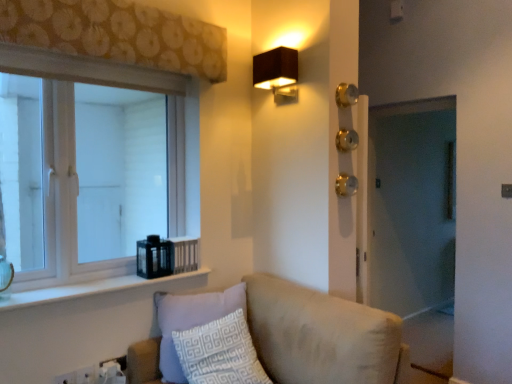
This screenshot has width=512, height=384. What do you see at coordinates (322, 336) in the screenshot?
I see `beige fabric couch at lower center` at bounding box center [322, 336].

This screenshot has height=384, width=512. Find the location of `clear glass vase at left`. clear glass vase at left is located at coordinates (5, 277).

Image resolution: width=512 pixels, height=384 pixels. I want to click on gold metallic door handle at center-right, so click(x=346, y=185).

Can you confirm if white wood window at left is wider than gold metallic door handle at center-right?

Indeed, white wood window at left has a greater width compared to gold metallic door handle at center-right.

Could you tell me if white wood window at left is turned towards gold metallic door handle at center-right?

No, white wood window at left is not facing towards gold metallic door handle at center-right.

Would you say white wood window at left is inside or outside gold metallic door handle at center-right?

white wood window at left is located beyond the bounds of gold metallic door handle at center-right.

Consider the image. What's the angular difference between white plastic electric outlet at lower left, positioned as the second electric outlet in right-to-left order, and beige fabric couch at lower center's facing directions?

The angular difference between white plastic electric outlet at lower left, positioned as the second electric outlet in right-to-left order, and beige fabric couch at lower center is 90.2 degrees.

Find the location of a particular element. This screenshot has height=384, width=512. studio couch above the white plastic electric outlet at lower left, the first electric outlet from the left (from the image's perspective) is located at coordinates (322, 336).

From a real-world perspective, which is physically above, white plastic electric outlet at lower left, which ranks as the first electric outlet in front-to-back order, or beige fabric couch at lower center?

beige fabric couch at lower center, from a real-world perspective.

Choose the correct answer: Is white plastic electric outlet at lower left, positioned as the 2th electric outlet in back-to-front order, inside beige fabric couch at lower center or outside it?

white plastic electric outlet at lower left, positioned as the 2th electric outlet in back-to-front order, exists outside the volume of beige fabric couch at lower center.

Considering the sizes of white wood window at left and beige fabric couch at lower center in the image, is white wood window at left wider or thinner than beige fabric couch at lower center?

Clearly, white wood window at left has less width compared to beige fabric couch at lower center.

From the picture: Considering the positions of objects white wood window at left and beige fabric couch at lower center in the image provided, who is in front, white wood window at left or beige fabric couch at lower center?

beige fabric couch at lower center is more forward.

Considering the sizes of objects white wood window at left and beige fabric couch at lower center in the image provided, who is taller, white wood window at left or beige fabric couch at lower center?

white wood window at left is taller.

Is white wood window at left facing towards beige fabric couch at lower center?

No, white wood window at left is not facing towards beige fabric couch at lower center.

Does point (80, 381) appear closer or farther from the camera than point (165, 53)?

Point (80, 381) appears to be closer to the viewer than point (165, 53).

Identify the location of curtain on the right side of white plastic electric outlet at lower left, marked as the 2th electric outlet in a left-to-right arrangement. (118, 34).

From the image's perspective, is white plastic electric outlet at lower left, which is counted as the first electric outlet, starting from the right, below brown floral fabric at upper left?

Yes, from the image's perspective, white plastic electric outlet at lower left, which is counted as the first electric outlet, starting from the right, is below brown floral fabric at upper left.

Is white plastic electric outlet at lower left, which is the second electric outlet in front-to-back order, in contact with brown floral fabric at upper left?

They are not placed beside each other.

Considering the sizes of objects clear glass vase at left and white glossy window sill at lower left in the image provided, who is smaller, clear glass vase at left or white glossy window sill at lower left?

Smaller between the two is clear glass vase at left.

Can you confirm if clear glass vase at left is wider than white glossy window sill at lower left?

No, clear glass vase at left is not wider than white glossy window sill at lower left.

In the scene shown: From a real-world perspective, relative to white glossy window sill at lower left, is clear glass vase at left vertically above or below?

clear glass vase at left is situated higher than white glossy window sill at lower left in the real world.

In the scene shown: From the image's perspective, between gold metallic door handle at center-right and brown floral fabric at upper left, who is located below?

gold metallic door handle at center-right, from the image's perspective.

Locate an element on the screen. This screenshot has height=384, width=512. door handle lying on the right of brown floral fabric at upper left is located at coordinates 346,185.

From a real-world perspective, is gold metallic door handle at center-right physically above brown floral fabric at upper left?

Incorrect, from a real-world perspective, gold metallic door handle at center-right is lower than brown floral fabric at upper left.

Is brown floral fabric at upper left in front of gold metallic door handle at center-right?

Yes.

Which object is positioned more to the left, brown floral fabric at upper left or gold metallic door handle at center-right?

From the viewer's perspective, brown floral fabric at upper left appears more on the left side.

Is gold metallic door handle at center-right a part of brown floral fabric at upper left?

Actually, gold metallic door handle at center-right is outside brown floral fabric at upper left.

Identify the location of curtain in front of the gold metallic door handle at center-right. The image size is (512, 384). (118, 34).

The image size is (512, 384). In order to click on window above the gold metallic door handle at center-right (from a real-world perspective) in this screenshot , I will do `click(91, 165)`.

The width and height of the screenshot is (512, 384). In order to click on the 2nd electric outlet to the left of the beige fabric couch at lower center, counting from the anchor's position in this screenshot , I will do `click(66, 378)`.

From the image, which object appears to be farther from white glossy window sill at lower left, clear glass vase at left or beige fabric couch at lower center?

beige fabric couch at lower center is positioned further to the anchor white glossy window sill at lower left.

From the image, which object appears to be nearer to clear glass vase at left, white wood window at left or white plastic electric outlet at lower left, which is the second electric outlet in front-to-back order?

Answer: white plastic electric outlet at lower left, which is the second electric outlet in front-to-back order, is positioned closer to the anchor clear glass vase at left.

Which object lies further to the anchor point beige fabric couch at lower center, brown floral fabric at upper left or white plastic electric outlet at lower left, marked as the 2th electric outlet in a left-to-right arrangement?

Among the two, brown floral fabric at upper left is located further to beige fabric couch at lower center.

Estimate the real-world distances between objects in this image. Which object is further from white wood window at left, gold metallic door handle at center-right or brown floral fabric at upper left?

gold metallic door handle at center-right.

Consider the image. Considering their positions, is white glossy window sill at lower left positioned closer to matte brown rectangular light fixture at upper right than gold metallic door handle at center-right?

Based on the image, gold metallic door handle at center-right appears to be nearer to matte brown rectangular light fixture at upper right.

From the image, which object appears to be farther from brown floral fabric at upper left, white plastic electric outlet at lower left, which is the second electric outlet in front-to-back order, or white wood window at left?

Based on the image, white plastic electric outlet at lower left, which is the second electric outlet in front-to-back order, appears to be further to brown floral fabric at upper left.

Looking at the image, which one is located further to matte brown rectangular light fixture at upper right, clear glass vase at left or gold metallic door handle at center-right?

Among the two, clear glass vase at left is located further to matte brown rectangular light fixture at upper right.

Estimate the real-world distances between objects in this image. Which object is further from white glossy window sill at lower left, matte brown rectangular light fixture at upper right or white wood window at left?

matte brown rectangular light fixture at upper right lies further to white glossy window sill at lower left than the other object.

Locate an element on the screen. The height and width of the screenshot is (384, 512). studio couch between brown floral fabric at upper left and white plastic electric outlet at lower left, the 1th electric outlet when ordered from back to front, in the up-down direction is located at coordinates (322, 336).

I want to click on fixture between brown floral fabric at upper left and white glossy window sill at lower left vertically, so click(x=277, y=73).

Where is `window sill between brown floral fabric at upper left and white plastic electric outlet at lower left, marked as the 2th electric outlet in a left-to-right arrangement, in the up-down direction`? window sill between brown floral fabric at upper left and white plastic electric outlet at lower left, marked as the 2th electric outlet in a left-to-right arrangement, in the up-down direction is located at coordinates (87, 289).

At what (x,y) coordinates should I click in order to perform the action: click on window between brown floral fabric at upper left and white plastic electric outlet at lower left, the 1th electric outlet when ordered from back to front, in the vertical direction. Please return your answer as a coordinate pair (x, y). Image resolution: width=512 pixels, height=384 pixels. Looking at the image, I should click on (91, 165).